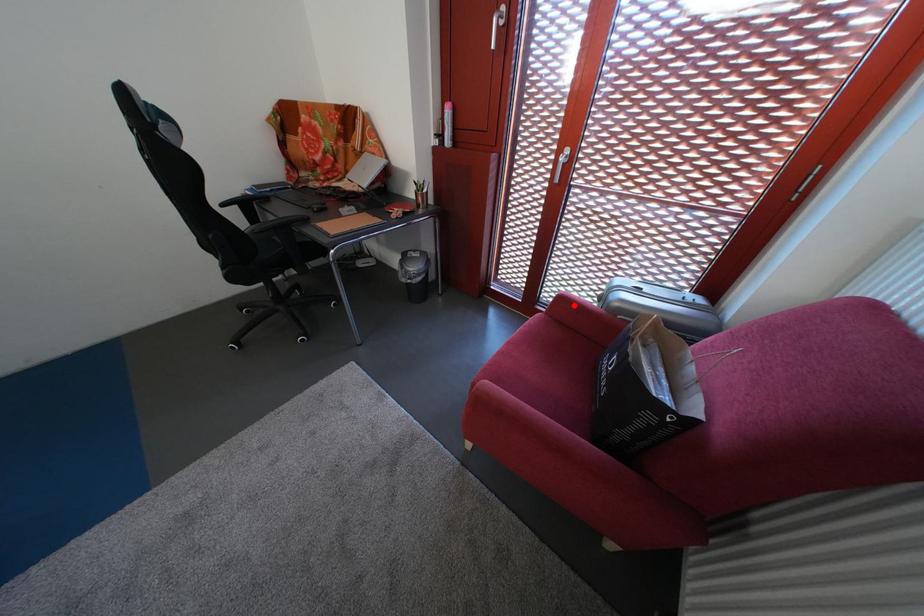
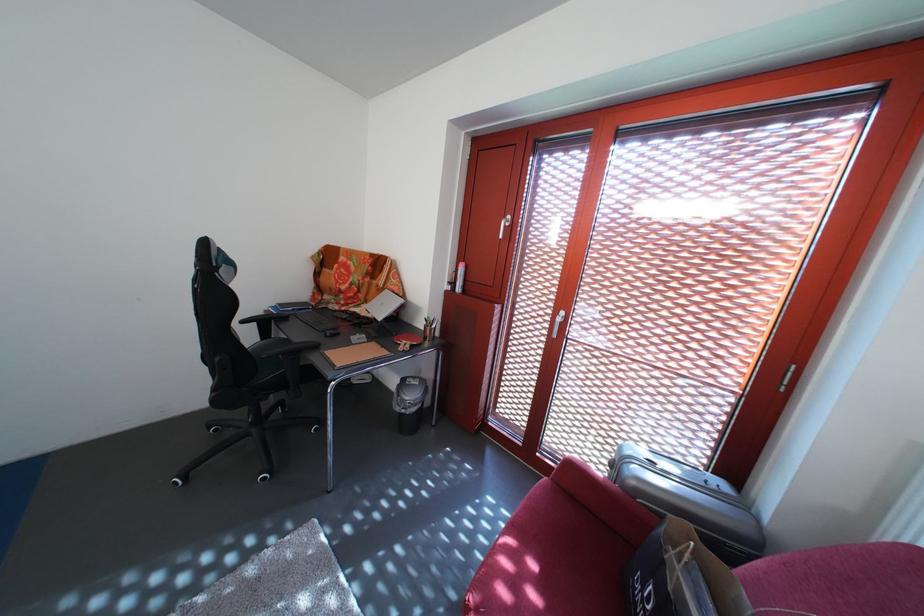
Question: I am providing you with two images of the same scene from different viewpoints. Given a red point in image1, look at the same physical point in image2. Is it:

Choices:
 (A) Closer to the viewpoint
 (B) Farther from the viewpoint

Answer: (B)